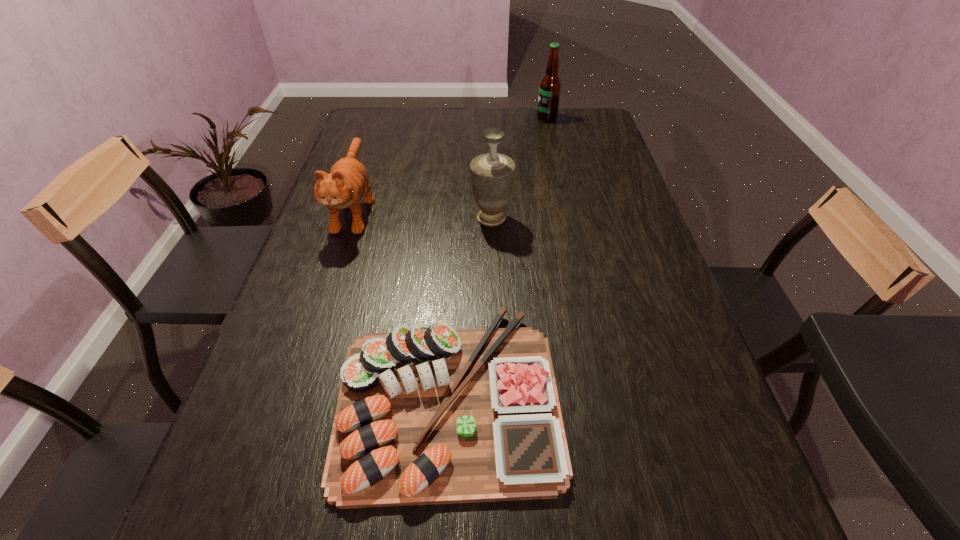
I want to click on beer bottle, so click(x=550, y=85).

Where is `the farthest object`? This screenshot has width=960, height=540. the farthest object is located at coordinates (550, 85).

What are the coordinates of `urn` in the screenshot? It's located at (492, 174).

Image resolution: width=960 pixels, height=540 pixels. Find the location of `the leftmost object`. the leftmost object is located at coordinates (348, 179).

The height and width of the screenshot is (540, 960). I want to click on cat, so click(348, 179).

You are a GUI agent. You are given a task and a screenshot of the screen. Output one action in this format:
    pyautogui.click(x=<x>, y=<y>)
    Task: Click on the shortest object
    
    Given the screenshot: What is the action you would take?
    pyautogui.click(x=426, y=415)

You are a GUI agent. You are given a task and a screenshot of the screen. Output one action in this format:
    pyautogui.click(x=<x>, y=<y>)
    Task: Click on the nearest object
    The width and height of the screenshot is (960, 540).
    Given the screenshot: What is the action you would take?
    pyautogui.click(x=426, y=415)

You are a GUI agent. You are given a task and a screenshot of the screen. Output one action in this format:
    pyautogui.click(x=<x>, y=<y>)
    Task: Click on the vacant space located 0.060m on the label of the farthest object
    Image resolution: width=960 pixels, height=540 pixels.
    Given the screenshot: What is the action you would take?
    pyautogui.click(x=520, y=118)

You are a GUI agent. You are given a task and a screenshot of the screen. Output one action in this format:
    pyautogui.click(x=<x>, y=<y>)
    Task: Click on the vacant space situated 0.340m on the label of the farthest object
    
    Given the screenshot: What is the action you would take?
    pyautogui.click(x=445, y=118)

This screenshot has height=540, width=960. Find the location of `vacant area situated 0.210m on the label of the farthest object`. vacant area situated 0.210m on the label of the farthest object is located at coordinates (480, 118).